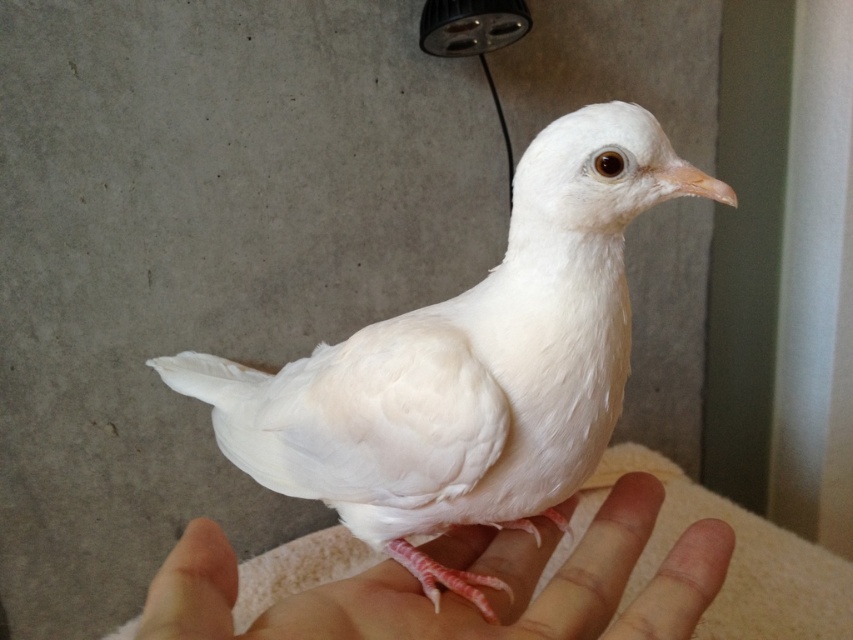
Which is behind, point (189, 385) or point (172, 630)?

The point (189, 385) is more distant.

Is point (260, 417) behind point (223, 552)?

Yes.

I want to click on white feathered bird at center, so click(469, 365).